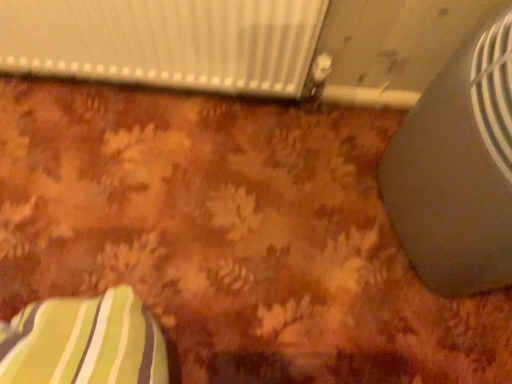
This screenshot has height=384, width=512. What do you see at coordinates (166, 42) in the screenshot?
I see `white textured radiator at upper center` at bounding box center [166, 42].

Image resolution: width=512 pixels, height=384 pixels. I want to click on white textured radiator at upper center, so click(x=166, y=42).

In order to face satin gray fan at right, should I rotate leftwards or rightwards?

Rotate right and turn 32.251 degrees.

Measure the distance between satin gray fan at right and camera.

The distance of satin gray fan at right from camera is 62.50 centimeters.

Describe the element at coordinates (457, 170) in the screenshot. I see `satin gray fan at right` at that location.

Locate an element on the screen. The image size is (512, 384). satin gray fan at right is located at coordinates (457, 170).

I want to click on white textured radiator at upper center, so click(166, 42).

From the picture: Which is more to the left, satin gray fan at right or white textured radiator at upper center?

Positioned to the left is white textured radiator at upper center.

Is satin gray fan at right positioned before white textured radiator at upper center?

Yes, it is in front of white textured radiator at upper center.

Is point (470, 261) in front of point (23, 54)?

Yes, it is.

From the image's perspective, which one is positioned higher, satin gray fan at right or white textured radiator at upper center?

From the image's view, white textured radiator at upper center is above.

From a real-world perspective, is satin gray fan at right on top of white textured radiator at upper center?

Correct, in the physical world, satin gray fan at right is higher than white textured radiator at upper center.

Looking at their sizes, would you say satin gray fan at right is wider or thinner than white textured radiator at upper center?

satin gray fan at right is wider than white textured radiator at upper center.

Considering the sizes of objects satin gray fan at right and white textured radiator at upper center in the image provided, who is shorter, satin gray fan at right or white textured radiator at upper center?

white textured radiator at upper center is shorter.

Is satin gray fan at right smaller than white textured radiator at upper center?

Incorrect, satin gray fan at right is not smaller in size than white textured radiator at upper center.

Looking at this image, could white textured radiator at upper center be considered to be inside satin gray fan at right?

No.

Are satin gray fan at right and white textured radiator at upper center beside each other?

satin gray fan at right and white textured radiator at upper center are clearly separated.

Is satin gray fan at right aimed at white textured radiator at upper center?

No, satin gray fan at right does not turn towards white textured radiator at upper center.

Measure the distance from satin gray fan at right to white textured radiator at upper center.

satin gray fan at right and white textured radiator at upper center are 20.21 inches apart.

This screenshot has height=384, width=512. Find the location of `radiator on the left of satin gray fan at right`. radiator on the left of satin gray fan at right is located at coordinates (166, 42).

Considering the positions of objects white textured radiator at upper center and satin gray fan at right in the image provided, who is more to the right, white textured radiator at upper center or satin gray fan at right?

Positioned to the right is satin gray fan at right.

Which object is closer to the camera taking this photo, white textured radiator at upper center or satin gray fan at right?

satin gray fan at right is closer to the camera.

Does point (229, 88) appear closer or farther from the camera than point (397, 234)?

Point (229, 88) is positioned farther from the camera compared to point (397, 234).

Consider the image. From the image's perspective, who appears lower, white textured radiator at upper center or satin gray fan at right?

From the image's view, satin gray fan at right is below.

From a real-world perspective, who is located lower, white textured radiator at upper center or satin gray fan at right?

white textured radiator at upper center, from a real-world perspective.

Which of these two, white textured radiator at upper center or satin gray fan at right, is thinner?

white textured radiator at upper center is thinner.

Is white textured radiator at upper center shorter than satin gray fan at right?

Yes.

Is white textured radiator at upper center smaller than satin gray fan at right?

Indeed, white textured radiator at upper center has a smaller size compared to satin gray fan at right.

Based on the photo, is white textured radiator at upper center inside the boundaries of satin gray fan at right, or outside?

white textured radiator at upper center is not enclosed by satin gray fan at right.

Is white textured radiator at upper center far away from satin gray fan at right?

That's not correct — white textured radiator at upper center is a little close to satin gray fan at right.

Does white textured radiator at upper center turn towards satin gray fan at right?

No, white textured radiator at upper center is not oriented towards satin gray fan at right.

Can you tell me how much white textured radiator at upper center and satin gray fan at right differ in facing direction?

white textured radiator at upper center and satin gray fan at right are facing 69.1 degrees away from each other.

How far apart are white textured radiator at upper center and satin gray fan at right?

The distance of white textured radiator at upper center from satin gray fan at right is 20.21 inches.

Identify the location of air conditioning below the white textured radiator at upper center (from the image's perspective). The width and height of the screenshot is (512, 384). (457, 170).

The image size is (512, 384). I want to click on air conditioning located below the white textured radiator at upper center (from the image's perspective), so click(457, 170).

Identify the location of air conditioning above the white textured radiator at upper center (from a real-world perspective). (457, 170).